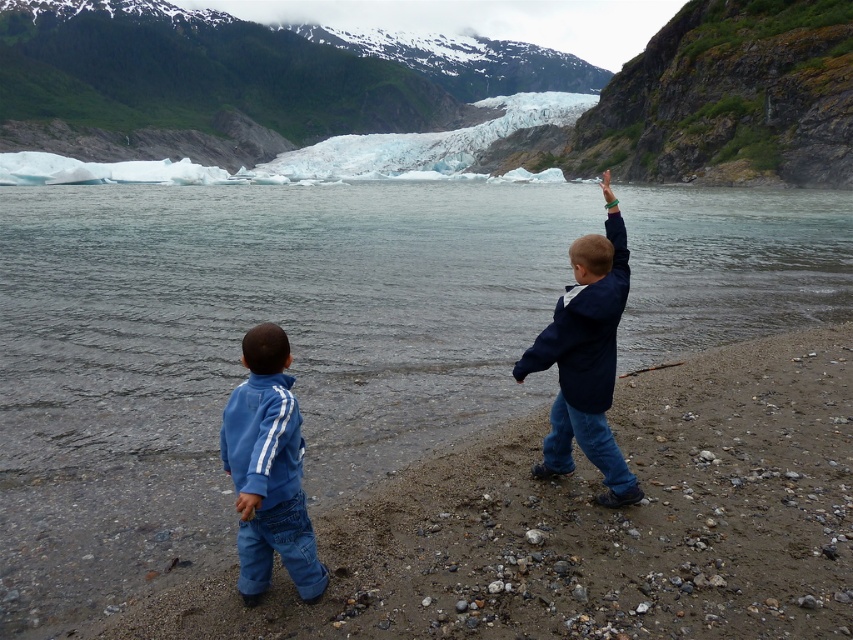
Question: Which is farther from the blue fleece jacket at lower left?

Choices:
 (A) navy blue jacket at right
 (B) smooth sand beach at lower center

Answer: (A)

Question: Estimate the real-world distances between objects in this image. Which object is farther from the navy blue jacket at right?

Choices:
 (A) blue fleece jacket at lower left
 (B) smooth sand beach at lower center

Answer: (A)

Question: Is smooth sand beach at lower center above blue fleece jacket at lower left?

Choices:
 (A) yes
 (B) no

Answer: (B)

Question: Does blue fleece jacket at lower left appear under navy blue jacket at right?

Choices:
 (A) no
 (B) yes

Answer: (B)

Question: Which object appears closest to the camera in this image?

Choices:
 (A) smooth sand beach at lower center
 (B) blue fleece jacket at lower left
 (C) navy blue jacket at right

Answer: (B)

Question: Does smooth sand beach at lower center have a larger size compared to navy blue jacket at right?

Choices:
 (A) yes
 (B) no

Answer: (B)